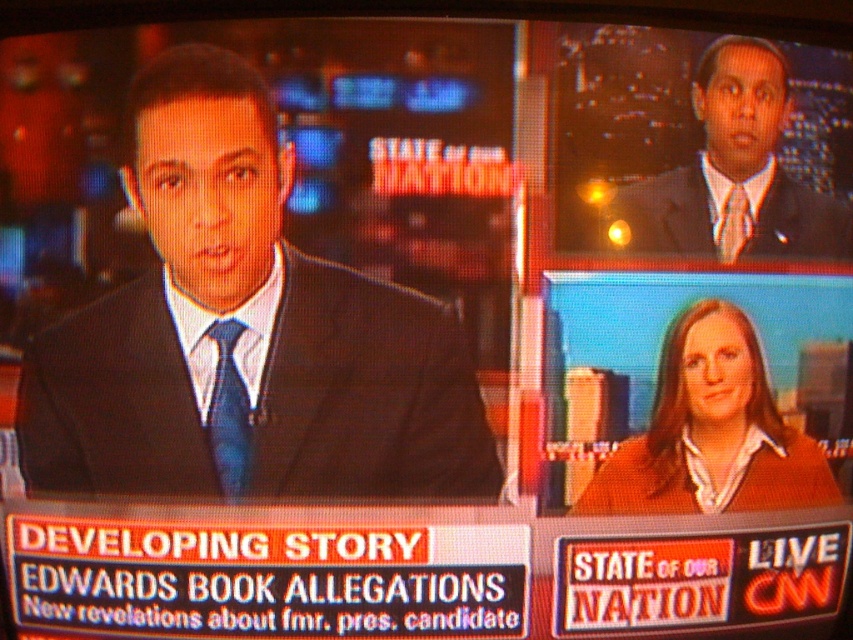
Based on the scene from CNN, which object has a smaller vertical size between the matte black suit at upper right and the blue silk tie at center?

The matte black suit at upper right has a lesser height compared to the blue silk tie at center, so the matte black suit at upper right is smaller in vertical size.

You are a costume designer analyzing the attire of the news anchors in the image. Which item of clothing is closer to you, the matte black suit at upper right or the blue silk tie at center?

The matte black suit at upper right is closer to you than the blue silk tie at center.

You are a costume designer analyzing the CNN broadcast screenshot. You notice the matte black suit at left and the blue silk tie at upper right. Which object occupies more horizontal space in the image?

The matte black suit at left might be wider than the blue silk tie at upper right according to the description.